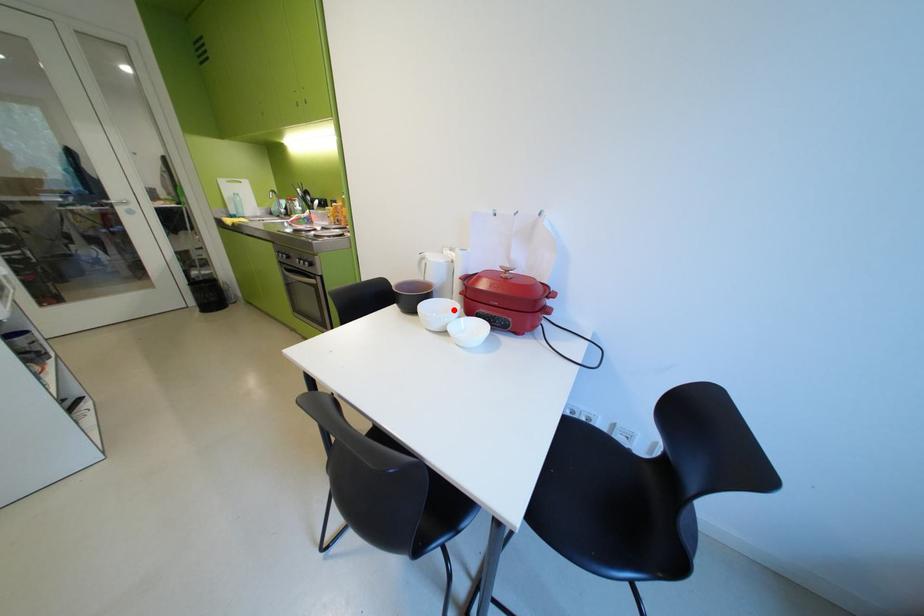
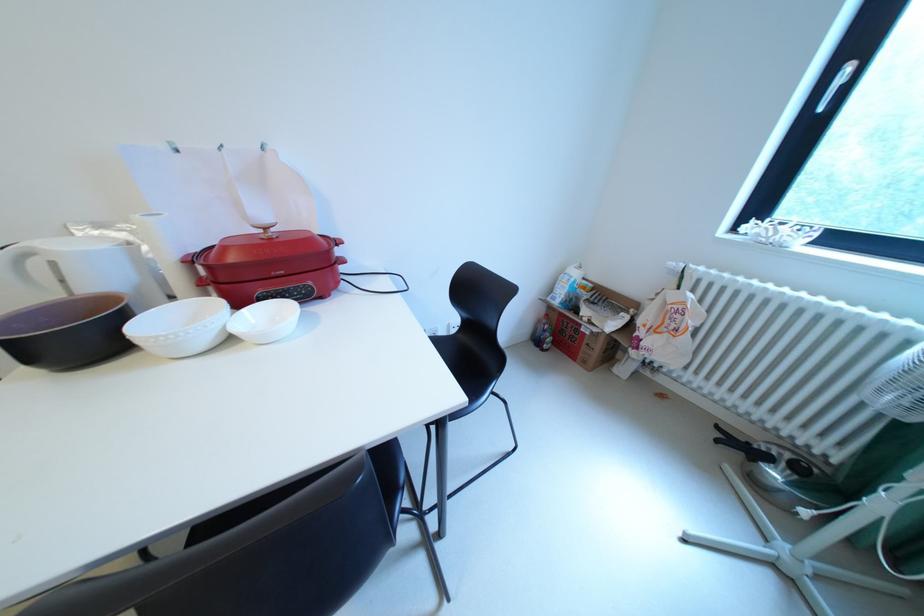
Find the pixel in the second image that matches the highlighted location in the first image.

(193, 321)